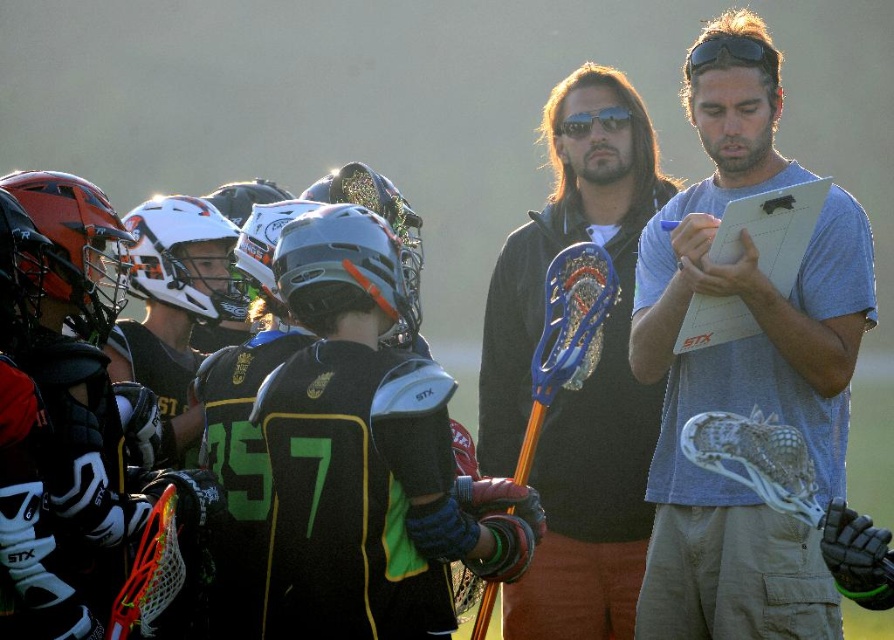
Question: Is gray cotton shirt at center closer to the viewer compared to black matte jacket at center?

Choices:
 (A) no
 (B) yes

Answer: (B)

Question: Among these points, which one is farthest from the camera?

Choices:
 (A) (587, 131)
 (B) (723, 129)

Answer: (A)

Question: From the image, what is the correct spatial relationship of gray cotton shirt at center in relation to black matte jacket at center?

Choices:
 (A) left
 (B) right

Answer: (B)

Question: Is gray cotton shirt at center positioned at the back of black matte jacket at center?

Choices:
 (A) yes
 (B) no

Answer: (B)

Question: Which of the following is the closest to the observer?

Choices:
 (A) (643, 529)
 (B) (670, 401)

Answer: (B)

Question: Which object appears closest to the camera in this image?

Choices:
 (A) black matte jacket at center
 (B) gray cotton shirt at center

Answer: (B)